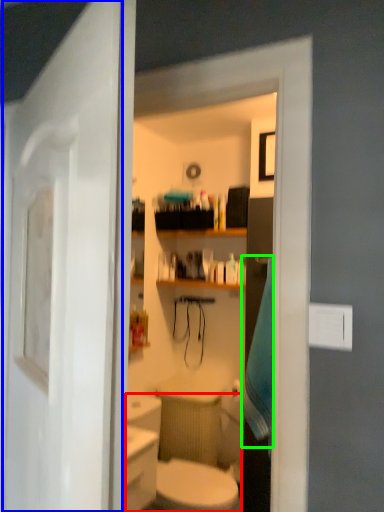
Question: Based on their relative distances, which object is farther from sink (highlighted by a red box)? Choose from door (highlighted by a blue box) and bath towel (highlighted by a green box).

Choices:
 (A) door
 (B) bath towel

Answer: (A)